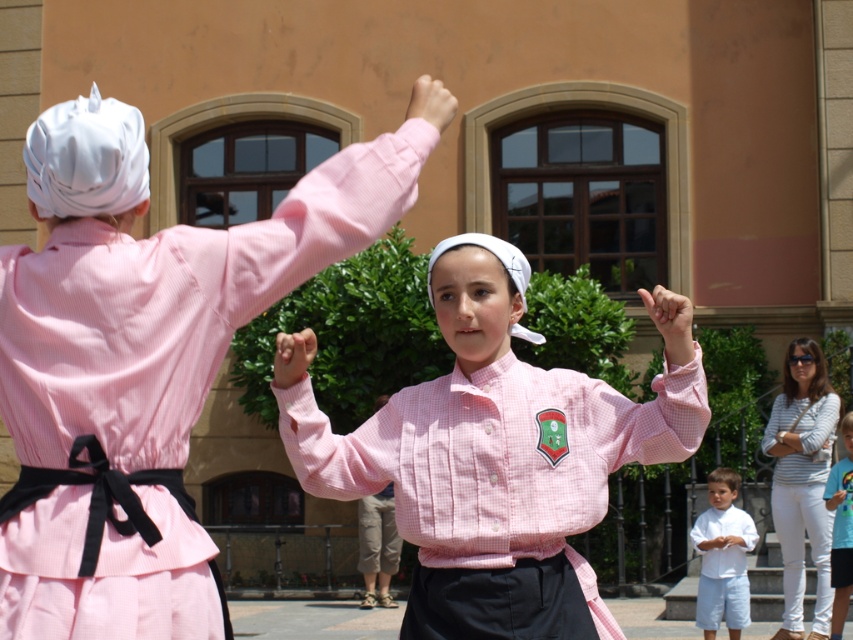
You are a photographer trying to capture both children in a single shot. The white striped shirt at upper right is blocking your view of the pink corduroy shirt at center. Can you move to the right to see both?

The pink corduroy shirt at center is behind the white striped shirt at upper right, so moving to the right may not help as the white striped shirt at upper right is still blocking the view.

You are a photographer taking pictures of the two children in the scene. You notice both the matte pink dress at back and the pink checkered shirt at center. Which child should you focus on to capture a full body shot without cropping the bottom of their outfit?

The matte pink dress at back is shorter than the pink checkered shirt at center, so focusing on the matte pink dress at back would allow a full body shot without cropping the bottom since it is shorter and requires less vertical space.

You are standing at the center of the image and want to locate the white striped shirt at upper right. Which direction should you look to find it?

The white striped shirt at upper right is located at point 0.753 on the x axis and 0.941 on the y axis, so you should look towards the upper right direction to find it.